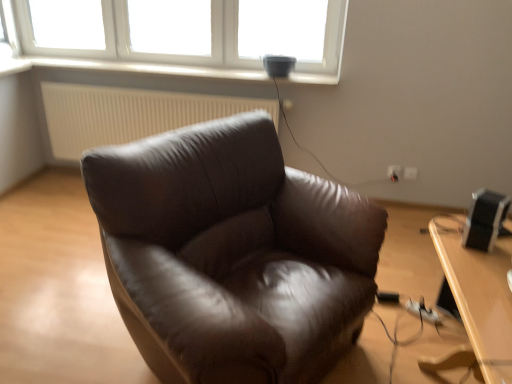
Question: From a real-world perspective, relative to light brown wooden table at lower right, is black plastic speaker at right vertically above or below?

Choices:
 (A) above
 (B) below

Answer: (A)

Question: Is black plastic speaker at right taller or shorter than light brown wooden table at lower right?

Choices:
 (A) tall
 (B) short

Answer: (B)

Question: Considering the real-world distances, which object is closest to the white textured radiator at upper center?

Choices:
 (A) white plastic window at upper center
 (B) light brown wooden table at lower right
 (C) white plastic electric outlet at lower right, arranged as the 1th electric outlet when viewed from the right
 (D) black plastic speaker at right
 (E) white plastic electric outlet at center-right, which is the 2th electric outlet in right-to-left order

Answer: (A)

Question: Estimate the real-world distances between objects in this image. Which object is farther from the light brown wooden table at lower right?

Choices:
 (A) white plastic window at upper center
 (B) white textured radiator at upper center
 (C) white plastic electric outlet at center-right, which is the 2th electric outlet in right-to-left order
 (D) black plastic speaker at right
 (E) white plastic electric outlet at lower right, arranged as the 1th electric outlet when viewed from the right

Answer: (A)